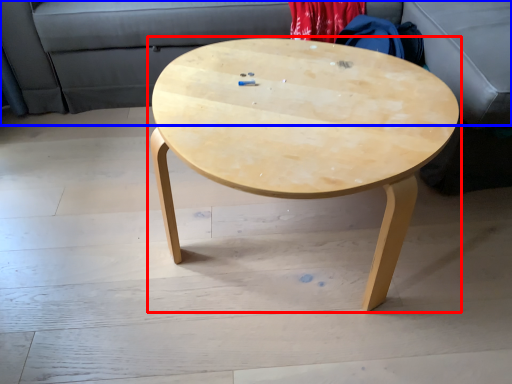
Question: Which point is further to the camera, coffee table (highlighted by a red box) or couch (highlighted by a blue box)?

Choices:
 (A) coffee table
 (B) couch

Answer: (B)